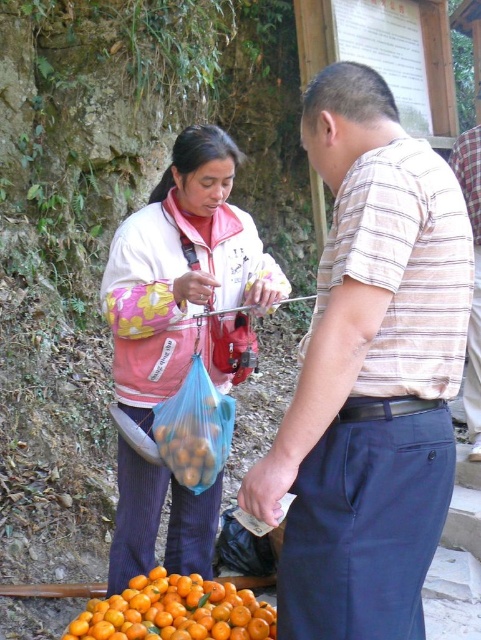
You are standing at the origin of the coordinate system. You want to walk to point B, which is located at point [217,224]. However, there is an obstacle at point A, which is at point [471,257]. Can you reach point B without passing through point A?

Point A is in front of point B, so you cannot reach point B without passing through point A.